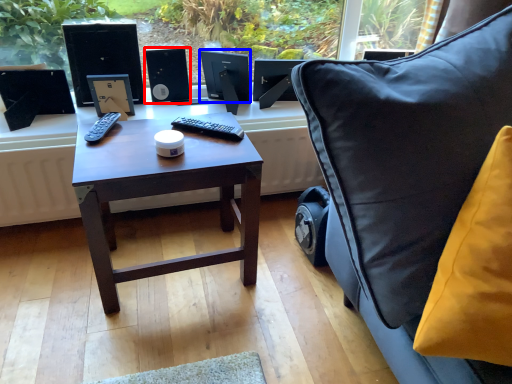
Question: Among these objects, which one is farthest to the camera, speaker (highlighted by a red box) or computer monitor (highlighted by a blue box)?

Choices:
 (A) speaker
 (B) computer monitor

Answer: (A)